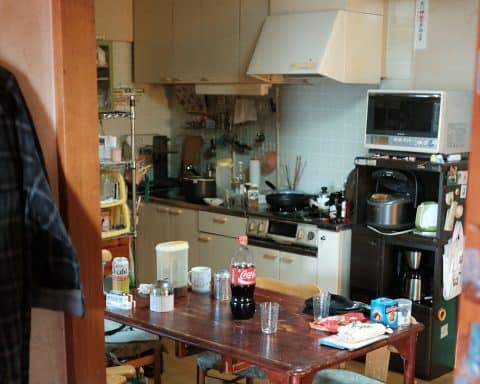
Image resolution: width=480 pixels, height=384 pixels. Find the location of `back of chair`. back of chair is located at coordinates (290, 286).